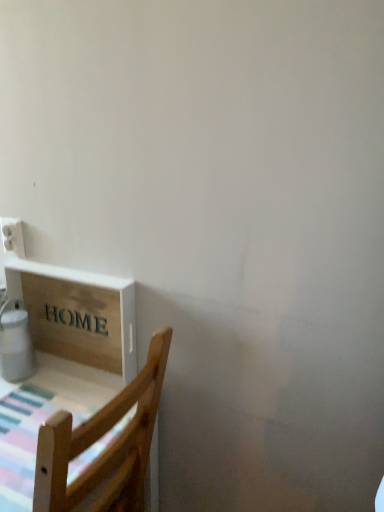
Locate an element on the screen. The height and width of the screenshot is (512, 384). vacant space situated above wooden chair at lower left (from a real-world perspective) is located at coordinates (48, 405).